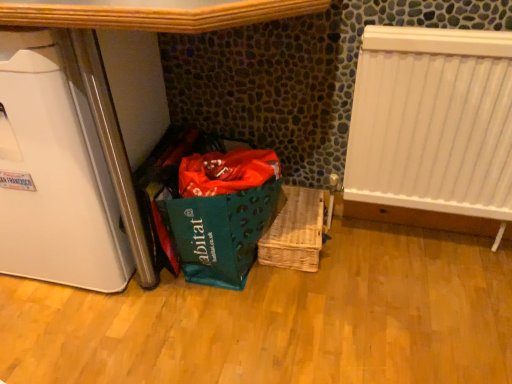
Question: Considering the positions of woven wood basket at center and white plastic radiator at right in the image, is woven wood basket at center bigger or smaller than white plastic radiator at right?

Choices:
 (A) small
 (B) big

Answer: (A)

Question: From their relative heights in the image, would you say woven wood basket at center is taller or shorter than white plastic radiator at right?

Choices:
 (A) tall
 (B) short

Answer: (B)

Question: Considering the real-world distances, which object is farthest from the white plastic radiator at right?

Choices:
 (A) white glossy refrigerator at left
 (B) woven wood basket at center

Answer: (A)

Question: Based on their relative distances, which object is farther from the white glossy refrigerator at left?

Choices:
 (A) white plastic radiator at right
 (B) woven wood basket at center

Answer: (A)